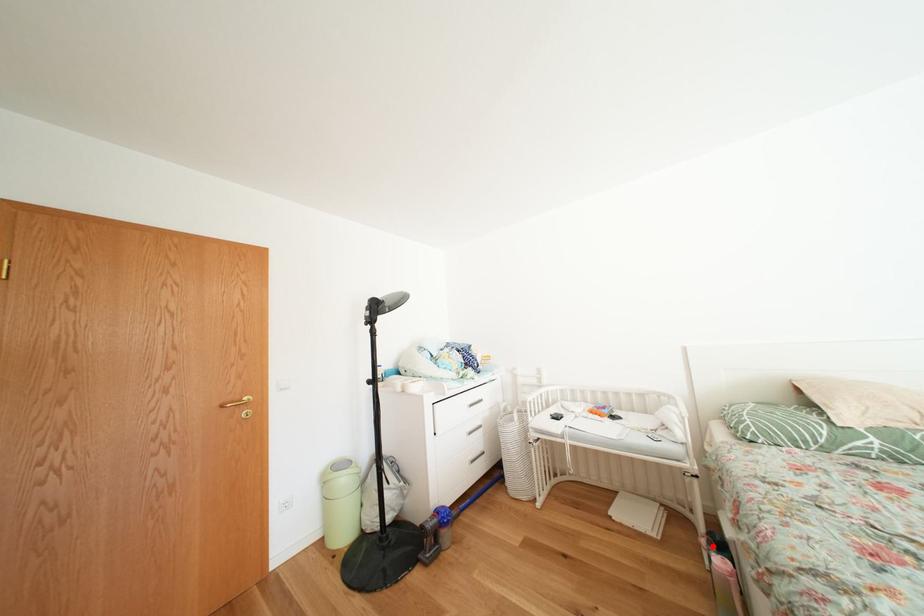
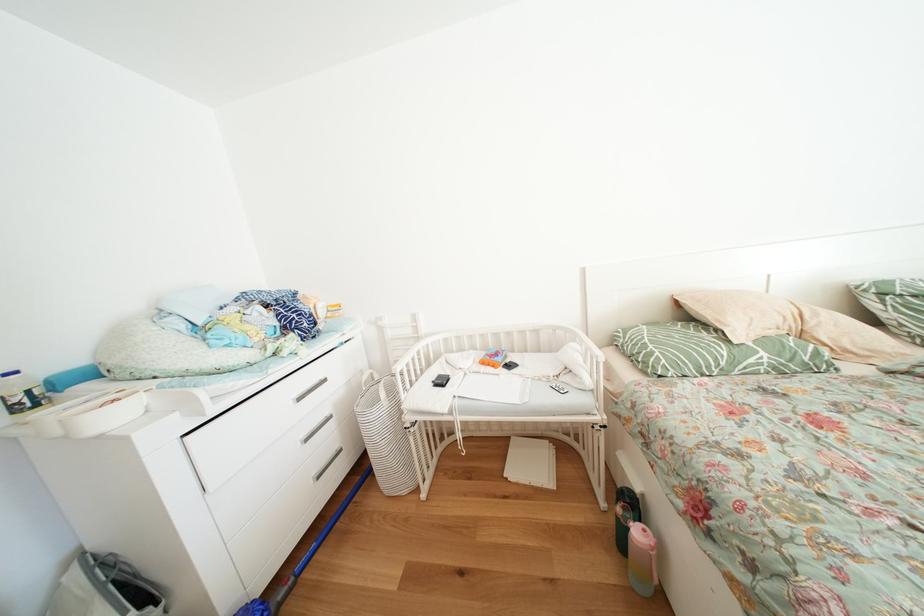
Question: I am providing you with two images of the same scene from different viewpoints. In image1, a red point is highlighted. Considering the same 3D point in image2, which of the following is correct?

Choices:
 (A) It is closer
 (B) It is farther

Answer: (B)